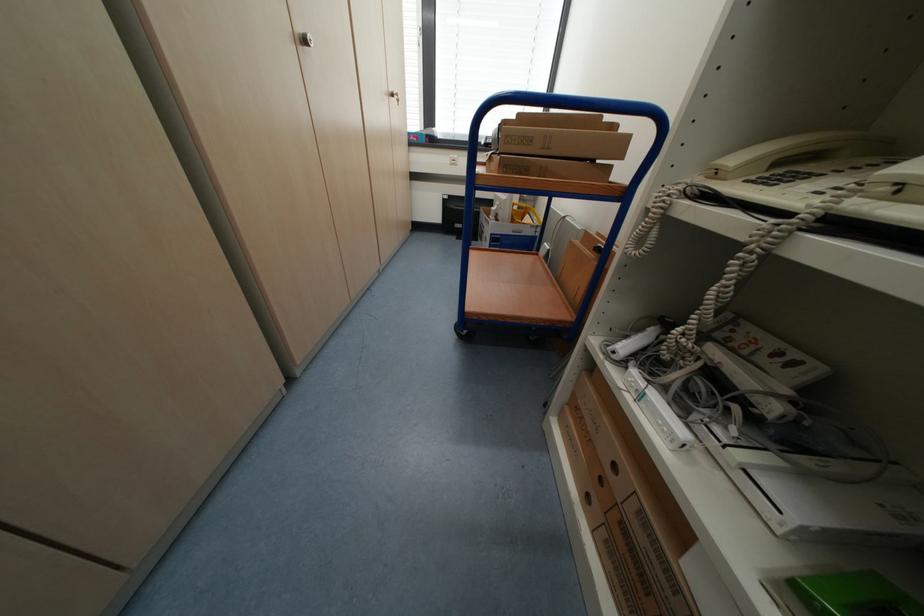
What are the coordinates of `video game case` in the screenshot? It's located at point(764,350).